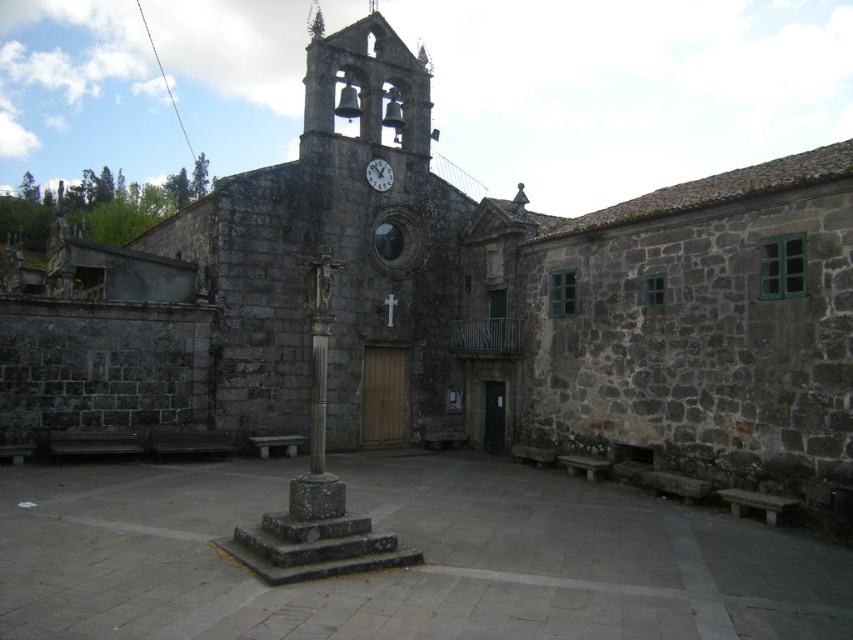
Who is more distant from viewer, (323,339) or (370,172)?

Positioned behind is point (370,172).

Is gray stone column at center smaller than white glossy clock at upper center?

No, gray stone column at center is not smaller than white glossy clock at upper center.

Locate an element on the screen. gray stone column at center is located at coordinates (318, 390).